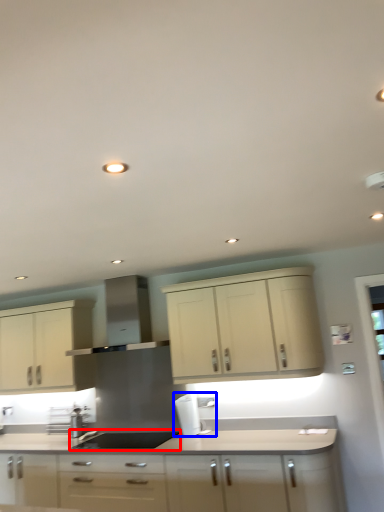
Question: Among these objects, which one is nearest to the camera, sink (highlighted by a red box) or coffee machine (highlighted by a blue box)?

Choices:
 (A) sink
 (B) coffee machine

Answer: (A)